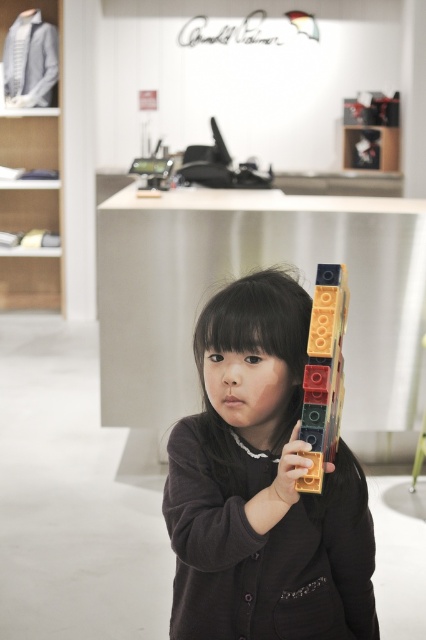
You are a customer in a store looking at the translucent plastic blocks at center and the gold plastic toy blocks at center on a counter. Which set of blocks is closer to you?

The translucent plastic blocks at center are closer to you because they are further to the viewer than the gold plastic toy blocks at center.

What is located at the coordinates point (324, 372) in the image?

The point (324, 372) marks translucent plastic blocks at center.

The user is trying to locate the matte plastic blocks at center in the image. Based on the coordinates provided, can you confirm if the point at (261, 486) is where the matte plastic blocks at center are located?

Yes, the point at (261, 486) corresponds to the matte plastic blocks at center as per the provided coordinates.